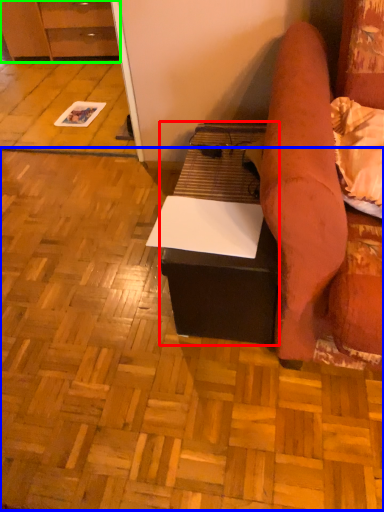
Question: Which object is the farthest from table (highlighted by a red box)? Choose among these: plywood (highlighted by a blue box) or cabinetry (highlighted by a green box).

Choices:
 (A) plywood
 (B) cabinetry

Answer: (B)